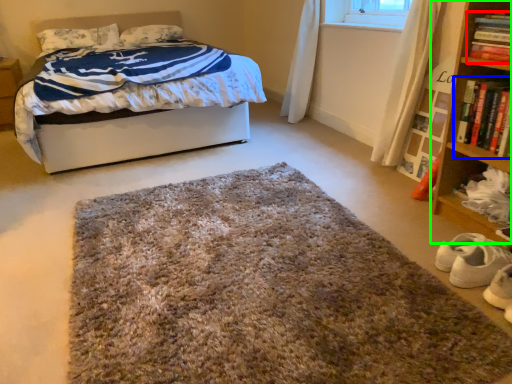
Question: Which object is positioned closest to book (highlighted by a red box)? Select from book (highlighted by a blue box) and bookcase (highlighted by a green box).

Choices:
 (A) book
 (B) bookcase

Answer: (A)